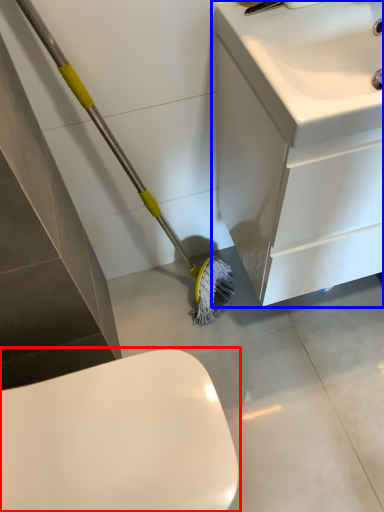
Question: Among these objects, which one is nearest to the camera, toilet (highlighted by a red box) or bathroom cabinet (highlighted by a blue box)?

Choices:
 (A) toilet
 (B) bathroom cabinet

Answer: (A)